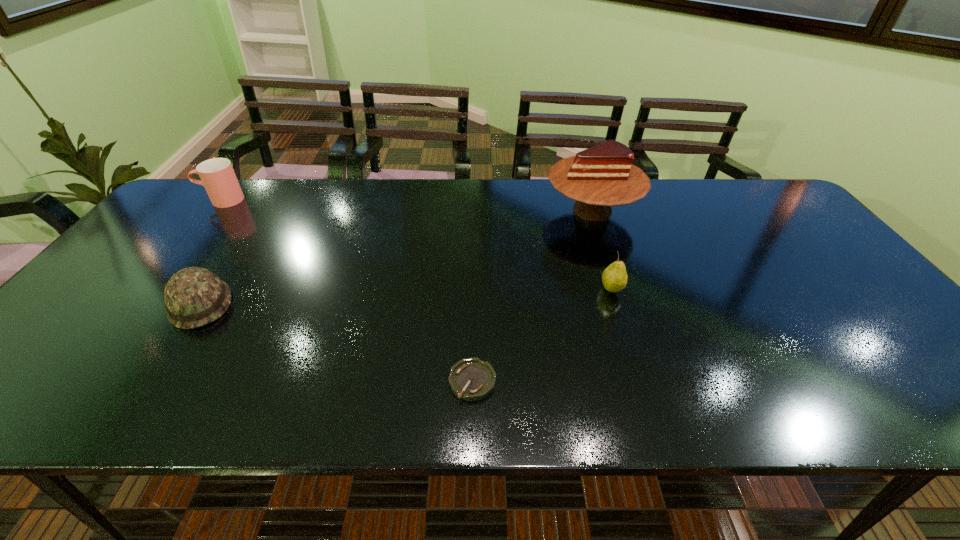
This screenshot has width=960, height=540. Identify the location of vacant space at the far left corner. (196, 199).

Where is `vacant area at the far right corner`? The image size is (960, 540). vacant area at the far right corner is located at coordinates (755, 205).

Locate an element on the screen. vacant area that lies between the pear and the cake is located at coordinates (602, 249).

This screenshot has width=960, height=540. What are the coordinates of `empty space that is in between the fourth object from right to left and the second tallest object` in the screenshot? It's located at (211, 252).

This screenshot has width=960, height=540. What are the coordinates of `empty location between the fourth object from right to left and the leftmost object` in the screenshot? It's located at (211, 252).

I want to click on vacant region between the tallest object and the nearest object, so coord(533,296).

Locate an element on the screen. Image resolution: width=960 pixels, height=540 pixels. free area in between the fourth object from right to left and the cake is located at coordinates (396, 257).

At what (x,y) coordinates should I click in order to perform the action: click on free space between the leftmost object and the pear. Please return your answer as a coordinate pair (x, y). This screenshot has width=960, height=540. Looking at the image, I should click on (417, 245).

Identify the location of vacant space that is in between the headwear and the ashtray. Image resolution: width=960 pixels, height=540 pixels. (336, 342).

Image resolution: width=960 pixels, height=540 pixels. What are the coordinates of `vacant space in between the pear and the nearest object` in the screenshot? It's located at (541, 335).